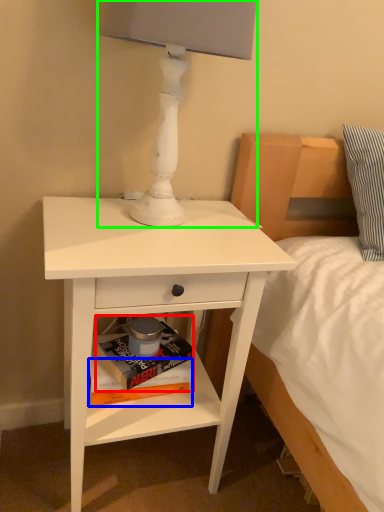
Question: Which is farther away from paperback book (highlighted by a red box)? paperback book (highlighted by a blue box) or table lamp (highlighted by a green box)?

Choices:
 (A) paperback book
 (B) table lamp

Answer: (B)